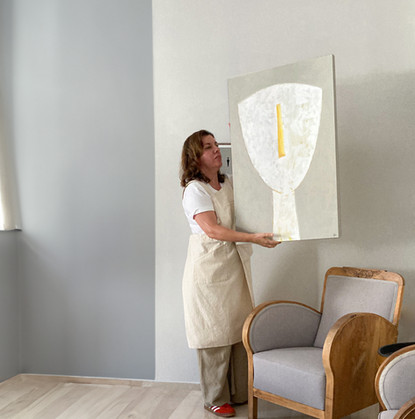
At what (x,y) coordinates should I click in order to perform the action: click on floor. Please return your answer as a coordinate pair (x, y). Looking at the image, I should click on (107, 391).